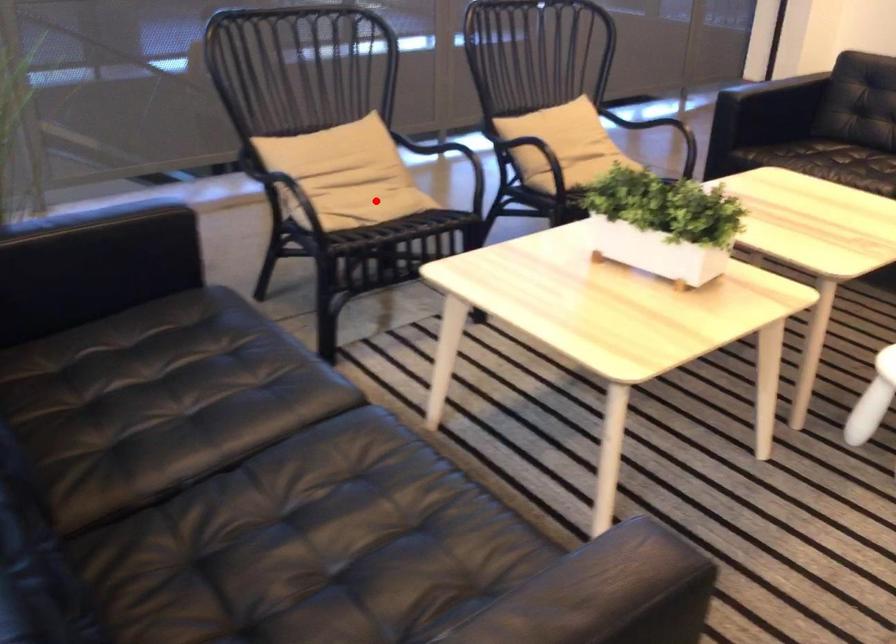
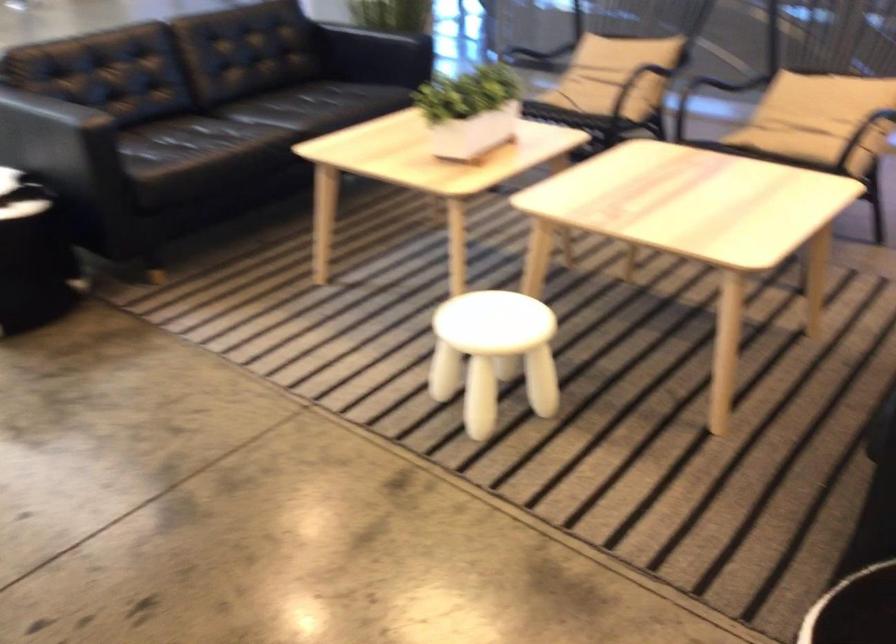
Question: I am providing you with two images of the same scene from different viewpoints. In image1, a red point is highlighted. Considering the same 3D point in image2, which of the following is correct?

Choices:
 (A) It is closer
 (B) It is farther

Answer: (B)